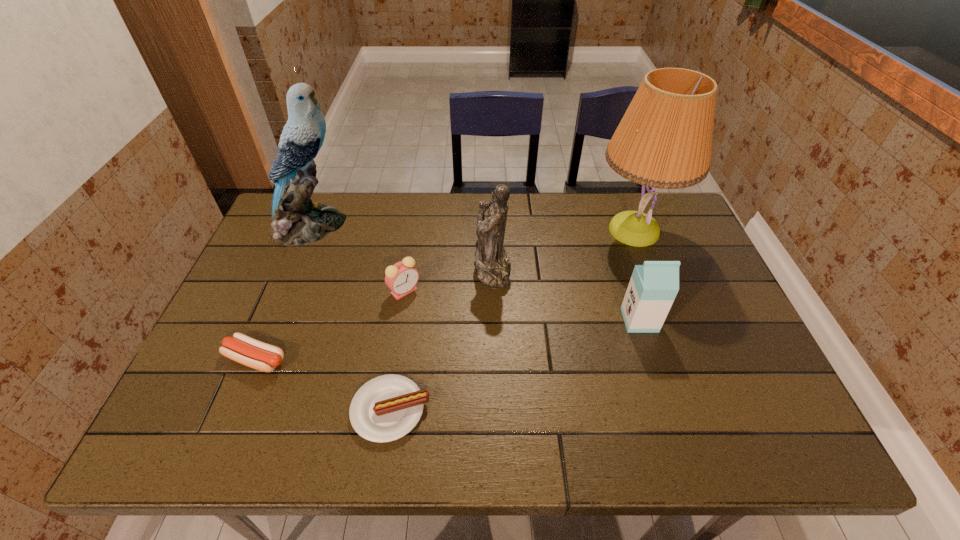
In the image, there is a desktop. At what (x,y) coordinates should I click in order to perform the action: click on vacant space at the far edge. Please return your answer as a coordinate pair (x, y). Looking at the image, I should click on (471, 223).

This screenshot has width=960, height=540. Identify the location of vacant space at the near edge of the desktop. (270, 415).

Locate an element on the screen. This screenshot has height=540, width=960. blank space at the left edge of the desktop is located at coordinates (305, 269).

This screenshot has width=960, height=540. In the image, there is a desktop. What are the coordinates of `vacant area at the right edge` in the screenshot? It's located at [x=756, y=368].

Where is `vacant space at the near left corner of the desktop`? vacant space at the near left corner of the desktop is located at coordinates (x=195, y=416).

This screenshot has height=540, width=960. Find the location of `vacant space at the far right corner of the desktop`. vacant space at the far right corner of the desktop is located at coordinates (632, 208).

Image resolution: width=960 pixels, height=540 pixels. I want to click on free space between the lamp and the figurine, so click(564, 249).

The height and width of the screenshot is (540, 960). Find the location of `free space between the left sausage and the parakeet`. free space between the left sausage and the parakeet is located at coordinates (283, 293).

This screenshot has height=540, width=960. In order to click on vacant area that lies between the shorter sausage and the figurine in this screenshot , I will do `click(442, 339)`.

Identify the location of free space between the third object from right to left and the shortest object. (442, 339).